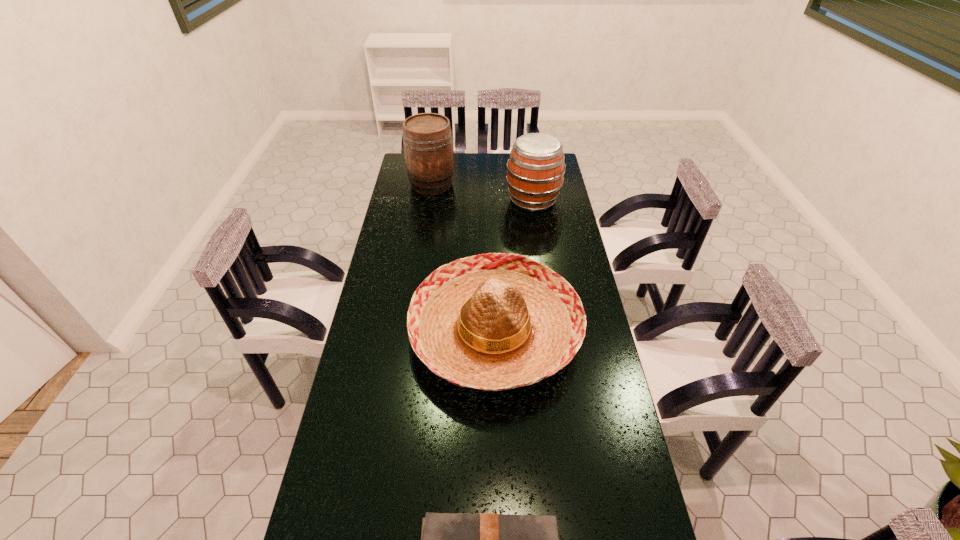
Identify the location of the left cider. point(427,137).

Where is `the right cider`? The height and width of the screenshot is (540, 960). the right cider is located at coordinates point(535,170).

The image size is (960, 540). I want to click on the third tallest object, so click(497, 321).

The image size is (960, 540). What are the coordinates of `sombrero` in the screenshot? It's located at (497, 321).

You are a GUI agent. You are given a task and a screenshot of the screen. Output one action in this format:
    pyautogui.click(x=<x>, y=<y>)
    Task: Click on the free location located 0.280m on the side of the left cider near the bung hole
    Image resolution: width=960 pixels, height=540 pixels.
    Given the screenshot: What is the action you would take?
    pyautogui.click(x=513, y=184)

The height and width of the screenshot is (540, 960). Identify the location of vacant area located 0.370m on the left of the right cider. (426, 200).

Where is `free space located on the left of the sombrero`? free space located on the left of the sombrero is located at coordinates (393, 332).

Image resolution: width=960 pixels, height=540 pixels. What are the coordinates of `object that is at the far edge` in the screenshot? It's located at (427, 137).

You are a GUI agent. You are given a task and a screenshot of the screen. Output one action in this format:
    pyautogui.click(x=<x>, y=<y>)
    Task: Click on the object present at the left edge
    Image resolution: width=960 pixels, height=540 pixels.
    Given the screenshot: What is the action you would take?
    pyautogui.click(x=427, y=137)

Identify the location of cider that is at the right edge. This screenshot has height=540, width=960. pos(535,170).